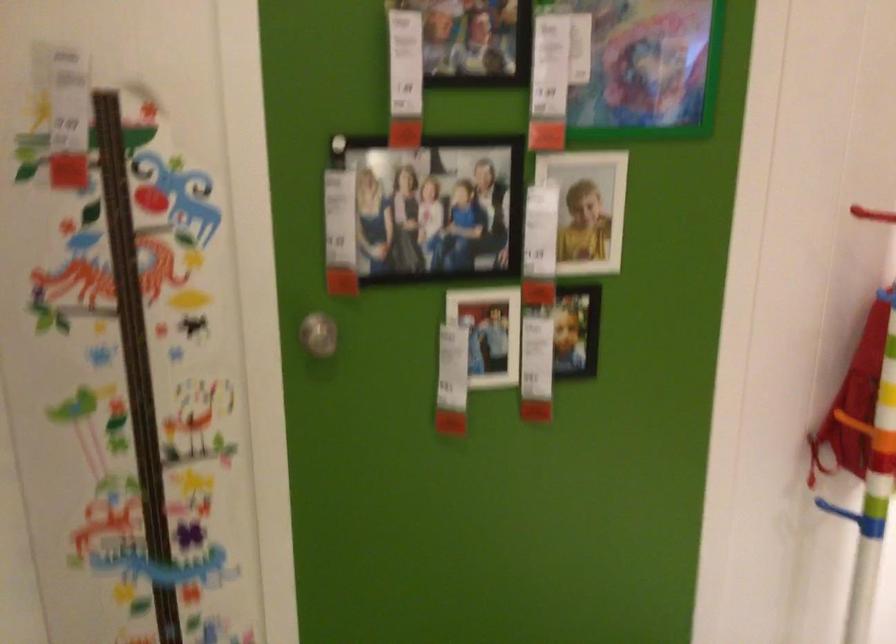
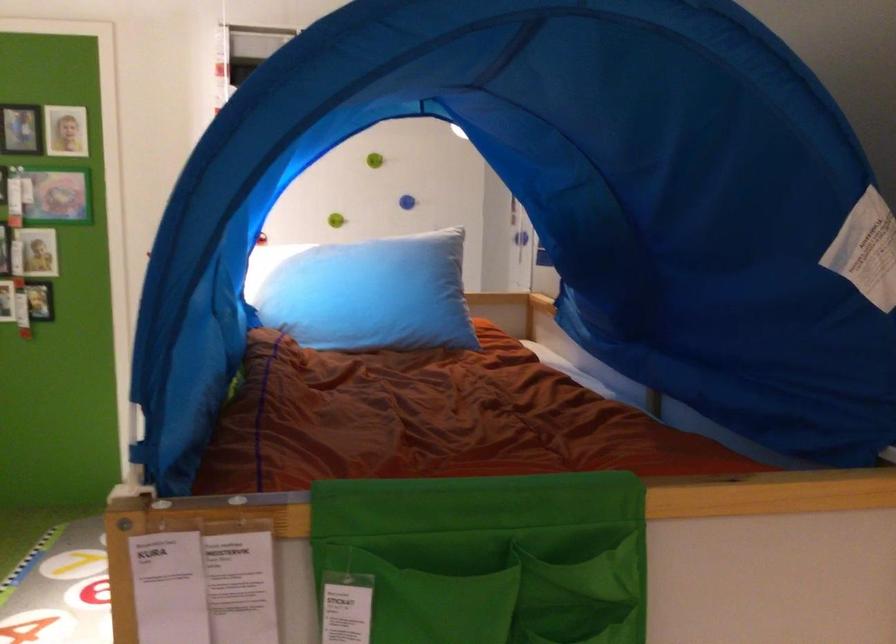
Where in the second image is the point corresponding to pixel 586 310 from the first image?

(39, 301)